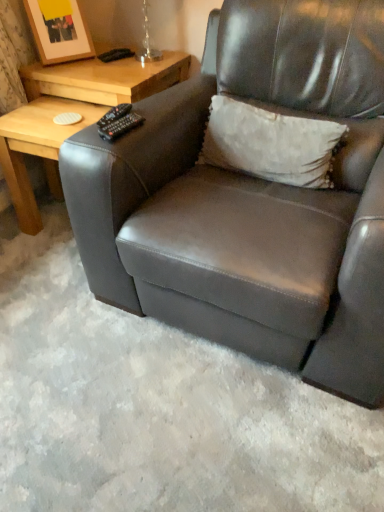
In order to click on vacant area to the right of wooden picture frame at upper left in this screenshot , I will do click(x=100, y=61).